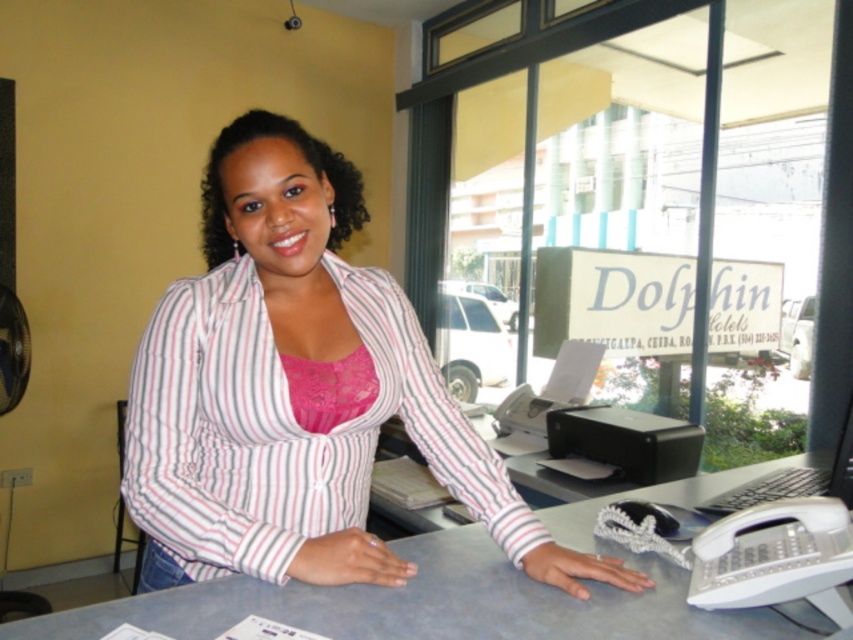
You are a guest at Dolphin Hotels and need to check in. You see the striped cotton shirt at center and the black plastic computer at lower right on the desk. Where is the computer located relative to the shirt?

The striped cotton shirt at center is positioned over the black plastic computer at lower right, so the computer is underneath the shirt.

Please provide the coordinates of the gray matte table at center in the image. The coordinate system is normalized such that the top left corner is at point 0,0 and the bottom right corner is at point 1,1. Please answer with the coordinates in the format of a tuple with two decimal places, like this example format answer would be like this answer format is like this answer format is like this answer format is like this answer format is like this answer format is like this answer format is like this answer.

The coordinates of the gray matte table at center are at point [454,593]. So the answer is the tuple with two decimal places, which is approximately [451,595].